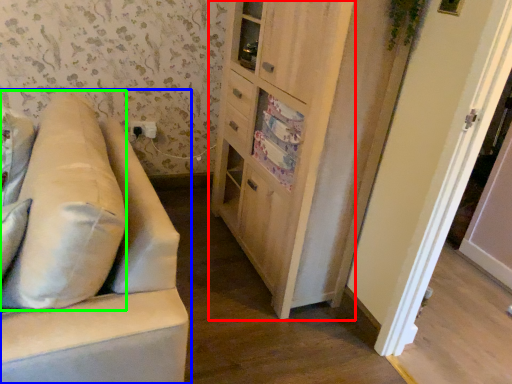
Question: Which is nearer to the cabinetry (highlighted by a red box)? studio couch (highlighted by a blue box) or pillow (highlighted by a green box).

Choices:
 (A) studio couch
 (B) pillow

Answer: (A)